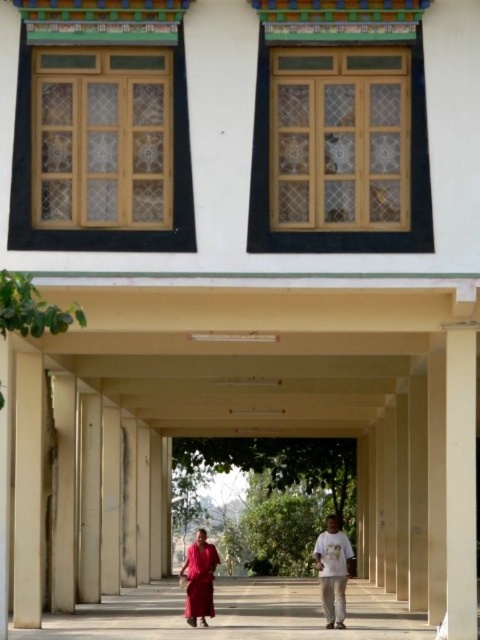
Is smooth concrete walkway at center further to camera compared to matte red dress at lower center?

No, smooth concrete walkway at center is in front of matte red dress at lower center.

Does smooth concrete walkway at center appear on the left side of matte red dress at lower center?

No, smooth concrete walkway at center is not to the left of matte red dress at lower center.

This screenshot has height=640, width=480. Describe the element at coordinates (236, 612) in the screenshot. I see `smooth concrete walkway at center` at that location.

The image size is (480, 640). In order to click on smooth concrete walkway at center in this screenshot , I will do [236, 612].

This screenshot has height=640, width=480. Identify the location of white cotton shirt at lower center. (333, 570).

Between white cotton shirt at lower center and matte red dress at lower center, which one appears on the left side from the viewer's perspective?

matte red dress at lower center is more to the left.

You are a GUI agent. You are given a task and a screenshot of the screen. Output one action in this format:
    pyautogui.click(x=<x>, y=<y>)
    Task: Click on the white cotton shirt at lower center
    This screenshot has width=480, height=640.
    Given the screenshot: What is the action you would take?
    pyautogui.click(x=333, y=570)

Is point (332, 579) in front of point (211, 548)?

Yes, point (332, 579) is closer to viewer.

Which of these two, reddish-brown fabric robe at center or matte red dress at lower center, stands shorter?

matte red dress at lower center is shorter.

Is point (202, 540) positioned in front of point (194, 600)?

No, (202, 540) is behind (194, 600).

Find the location of a particular element. reddish-brown fabric robe at center is located at coordinates (334, 570).